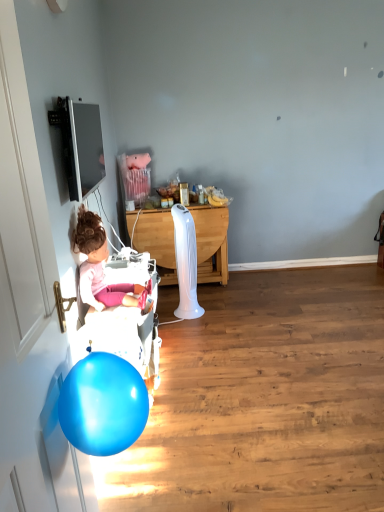
Based on the photo, measure the distance between point (195, 221) and camera.

They are 3.46 meters apart.

Describe the element at coordinates (102, 269) in the screenshot. I see `matte pink doll at left` at that location.

Where is `white wood desk at center`? white wood desk at center is located at coordinates click(211, 243).

Does point (150, 243) come closer to viewer compared to point (93, 42)?

No, (150, 243) is behind (93, 42).

Considering the relative sizes of white wood desk at center and white glossy door at left in the image provided, is white wood desk at center smaller than white glossy door at left?

Incorrect, white wood desk at center is not smaller in size than white glossy door at left.

Is white wood desk at center wider than white glossy door at left?

Correct, the width of white wood desk at center exceeds that of white glossy door at left.

From the image's perspective, which is below, white wood desk at center or white glossy door at left?

white glossy door at left appears lower in the image.

Where is `door that appears above the white plastic baby carriage at left (from the image's perspective)`? Image resolution: width=384 pixels, height=512 pixels. door that appears above the white plastic baby carriage at left (from the image's perspective) is located at coordinates (38, 231).

Does white plastic baby carriage at left come behind white glossy door at left?

Yes, white plastic baby carriage at left is further from the camera.

How distant is white plastic baby carriage at left from white glossy door at left?

The distance of white plastic baby carriage at left from white glossy door at left is 55.96 centimeters.

Based on the photo, is white plastic baby carriage at left facing towards white glossy door at left?

No.

From the image's perspective, is white plastic baby carriage at left above white wood desk at center?

Incorrect, from the image's perspective, white plastic baby carriage at left is lower than white wood desk at center.

I want to click on desk behind the white plastic baby carriage at left, so click(x=211, y=243).

Consider the image. From a real-world perspective, which is physically above, white plastic baby carriage at left or white wood desk at center?

In real-world perspective, white wood desk at center is above.

Is white plastic baby carriage at left bigger than matte pink doll at left?

Correct, white plastic baby carriage at left is larger in size than matte pink doll at left.

Are white plastic baby carriage at left and matte pink doll at left making contact?

No.

Is white plastic baby carriage at left looking in the opposite direction of matte pink doll at left?

No, white plastic baby carriage at left's orientation is not away from matte pink doll at left.

Considering the positions of objects white plastic baby carriage at left and matte pink doll at left in the image provided, who is more to the left, white plastic baby carriage at left or matte pink doll at left?

Positioned to the left is matte pink doll at left.

In the scene shown: How different are the orientations of matte pink doll at left and white plastic baby carriage at left in degrees?

The angle between the facing direction of matte pink doll at left and the facing direction of white plastic baby carriage at left is 0.63 degrees.

Is matte pink doll at left situated inside white plastic baby carriage at left or outside?

matte pink doll at left cannot be found inside white plastic baby carriage at left.

In terms of size, does matte pink doll at left appear bigger or smaller than white plastic baby carriage at left?

In the image, matte pink doll at left appears to be smaller than white plastic baby carriage at left.

Based on the photo, how many degrees apart are the facing directions of matte pink doll at left and white glossy door at left?

The angular difference between matte pink doll at left and white glossy door at left is 2.37 degrees.

Can you see matte pink doll at left touching white glossy door at left?

No, matte pink doll at left is not in contact with white glossy door at left.

From the image's perspective, which one is positioned higher, matte pink doll at left or white glossy door at left?

matte pink doll at left, from the image's perspective.

Can you confirm if matte pink doll at left is taller than white glossy door at left?

No.

Would you consider matte pink doll at left to be distant from white wood desk at center?

Indeed, matte pink doll at left is not near white wood desk at center.

Considering the sizes of objects matte pink doll at left and white wood desk at center in the image provided, who is thinner, matte pink doll at left or white wood desk at center?

matte pink doll at left.

Could you tell me if matte pink doll at left is facing white wood desk at center?

No, matte pink doll at left is not oriented towards white wood desk at center.

Is matte pink doll at left positioned in front of white wood desk at center?

Yes, matte pink doll at left is closer to the viewer.

You are a GUI agent. You are given a task and a screenshot of the screen. Output one action in this format:
    pyautogui.click(x=<x>, y=<y>)
    Task: Click on the desk located above the white glossy door at left (from the image's perspective)
    This screenshot has width=384, height=512.
    Given the screenshot: What is the action you would take?
    pyautogui.click(x=211, y=243)

This screenshot has height=512, width=384. What are the coordinates of `door in front of the white plastic baby carriage at left` in the screenshot? It's located at pos(38,231).

Which object lies further to the anchor point white glossy door at left, white plastic baby carriage at left or matte pink doll at left?

white plastic baby carriage at left is further to white glossy door at left.

From the image, which object appears to be nearer to white glossy door at left, white plastic baby carriage at left or white wood desk at center?

Among the two, white plastic baby carriage at left is located nearer to white glossy door at left.

Which object lies further to the anchor point matte pink doll at left, white plastic baby carriage at left or white glossy door at left?

The object further to matte pink doll at left is white glossy door at left.

Looking at the image, which one is located further to white plastic baby carriage at left, white wood desk at center or matte pink doll at left?

Based on the image, white wood desk at center appears to be further to white plastic baby carriage at left.

Estimate the real-world distances between objects in this image. Which object is further from white wood desk at center, white plastic baby carriage at left or matte pink doll at left?

matte pink doll at left is positioned further to the anchor white wood desk at center.

From the image, which object appears to be farther from white wood desk at center, white glossy door at left or matte pink doll at left?

Based on the image, white glossy door at left appears to be further to white wood desk at center.

Considering their positions, is white plastic baby carriage at left positioned closer to white wood desk at center than white glossy door at left?

white plastic baby carriage at left is closer to white wood desk at center.

Based on their spatial positions, is white wood desk at center or matte pink doll at left further from white glossy door at left?

Based on the image, white wood desk at center appears to be further to white glossy door at left.

This screenshot has width=384, height=512. What are the coordinates of `person between white glossy door at left and white plastic baby carriage at left from front to back` in the screenshot? It's located at (102, 269).

The image size is (384, 512). I want to click on baby carriage located between white glossy door at left and white wood desk at center in the depth direction, so click(x=123, y=339).

This screenshot has width=384, height=512. I want to click on person between white glossy door at left and white wood desk at center in the front-back direction, so click(102, 269).

Identify the location of baby carriage located between matte pink doll at left and white wood desk at center in the depth direction. The height and width of the screenshot is (512, 384). (123, 339).